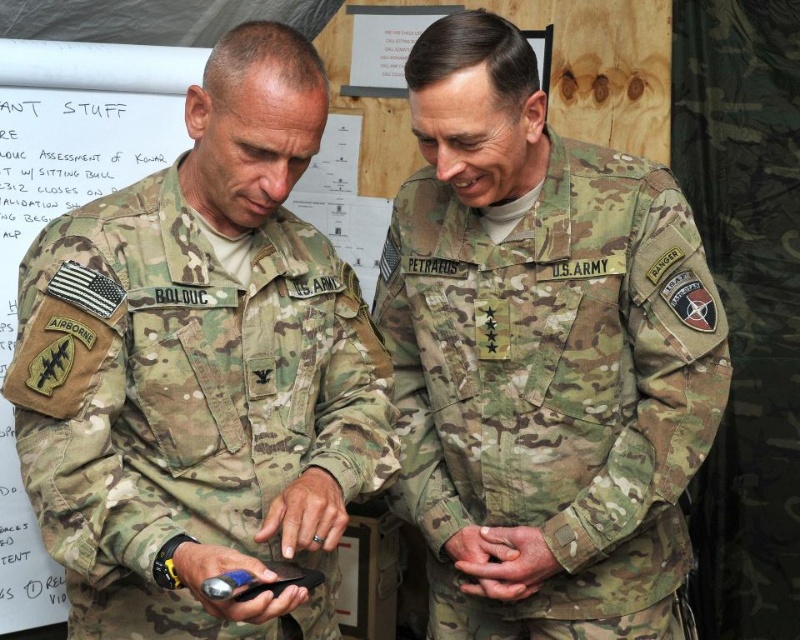
Who is positioned more to the left, camouflage uniform at center or camouflage fabric us army uniform at center?

From the viewer's perspective, camouflage uniform at center appears more on the left side.

Find the location of a particular element. camouflage uniform at center is located at coordinates (202, 371).

Find the location of a particular element. camouflage uniform at center is located at coordinates click(202, 371).